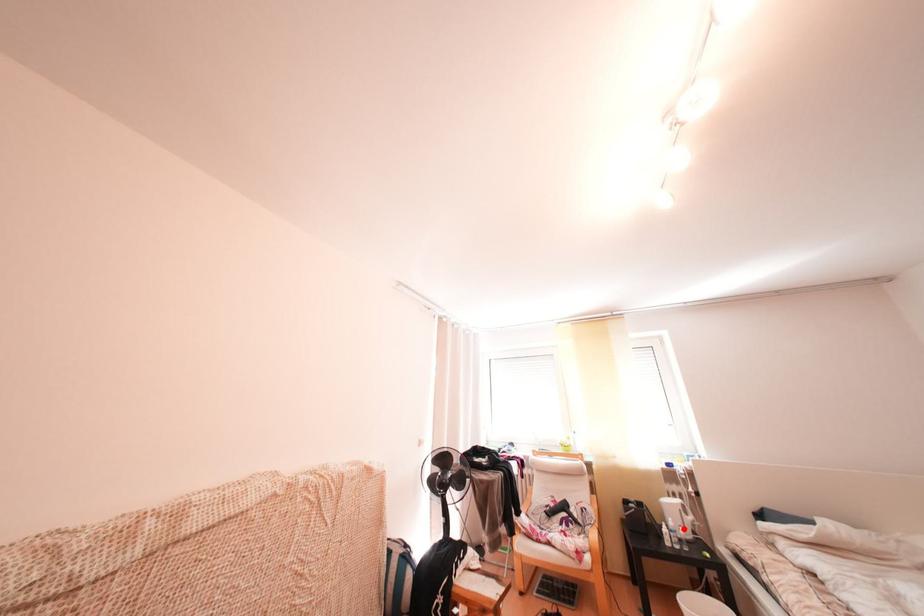
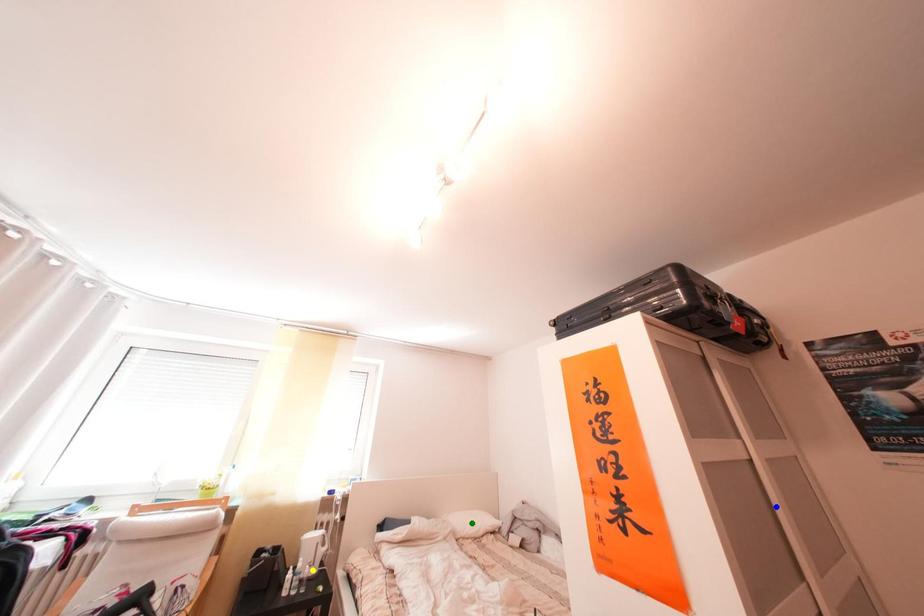
Question: I am providing you with two images of the same scene from different viewpoints. A red point is marked on the first image. You are given multiple points on the second image. Which point in image 2 is actually the same real-world point as the red point in image 1?

Choices:
 (A) yellow point
 (B) blue point
 (C) green point

Answer: (A)